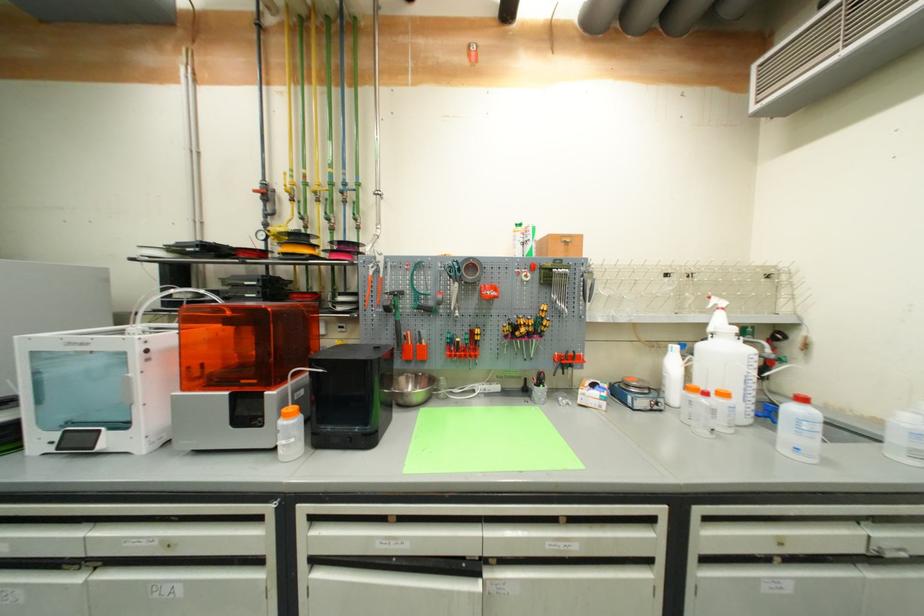
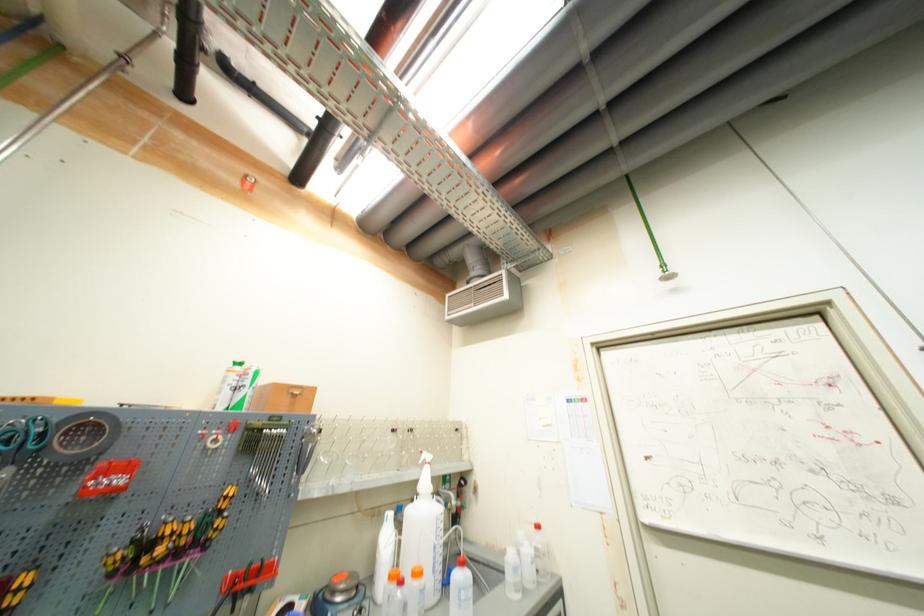
Locate, in the second image, the point that corresponds to point 542,320 in the first image.

(211, 517)